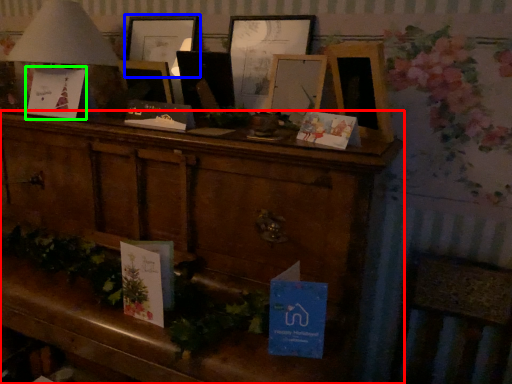
Question: Based on their relative distances, which object is farther from furniture (highlighted by a red box)? Choose from picture frame (highlighted by a blue box) and christmas card (highlighted by a green box).

Choices:
 (A) picture frame
 (B) christmas card

Answer: (A)